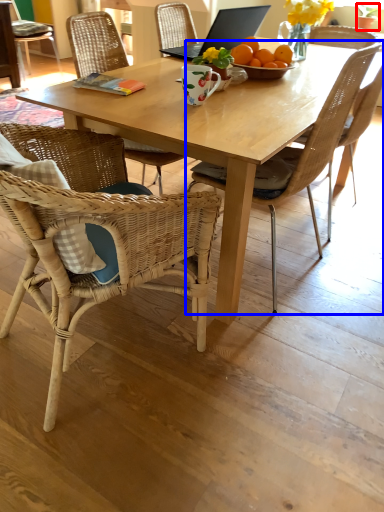
Question: Among these objects, which one is farthest to the camera, houseplant (highlighted by a red box) or chair (highlighted by a blue box)?

Choices:
 (A) houseplant
 (B) chair

Answer: (A)